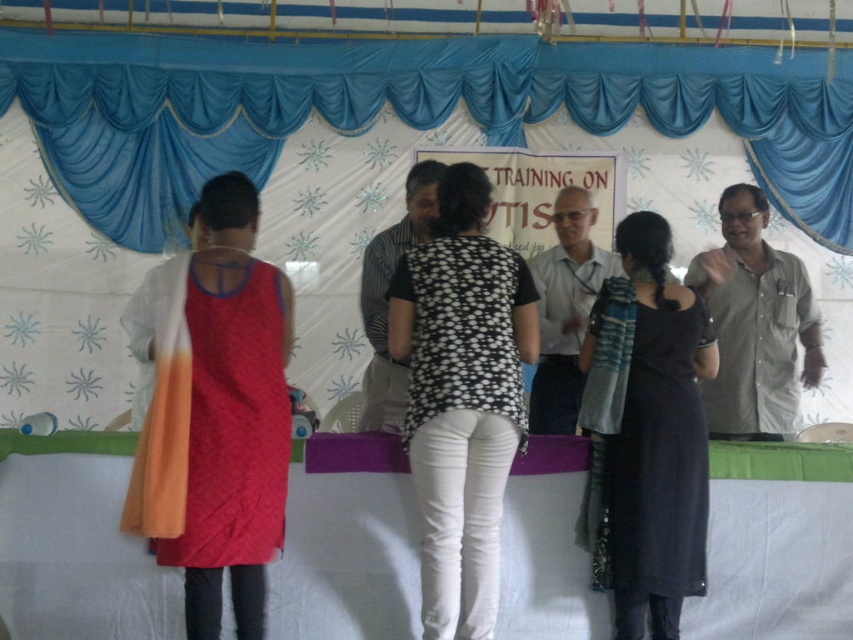
Question: Which point is closer to the camera?

Choices:
 (A) blue fabric canopy at upper center
 (B) black woolen dress at center

Answer: (B)

Question: Does orange fabric dress at left appear over black woolen dress at center?

Choices:
 (A) no
 (B) yes

Answer: (B)

Question: Estimate the real-world distances between objects in this image. Which object is closer to the orange fabric dress at left?

Choices:
 (A) black dotted shirt at center
 (B) blue fabric canopy at upper center
 (C) black woolen dress at center

Answer: (A)

Question: Can you confirm if blue fabric canopy at upper center is smaller than black woolen dress at center?

Choices:
 (A) yes
 (B) no

Answer: (B)

Question: Is black dotted shirt at center above black woolen dress at center?

Choices:
 (A) no
 (B) yes

Answer: (B)

Question: Which point is farther from the camera taking this photo?

Choices:
 (A) (465, 499)
 (B) (625, 525)
 (C) (418, 129)
 (D) (239, 378)

Answer: (C)